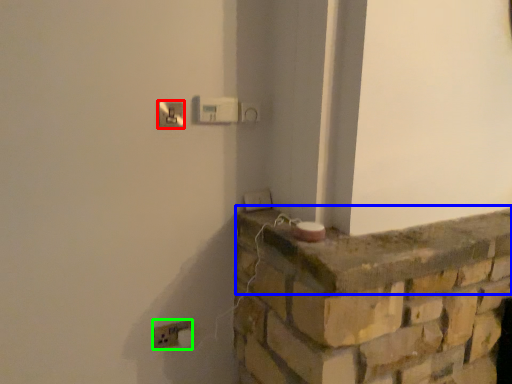
Question: Which object is the farthest from light switch (highlighted by a red box)? Choose among these: ledge (highlighted by a blue box) or electric outlet (highlighted by a green box).

Choices:
 (A) ledge
 (B) electric outlet

Answer: (A)